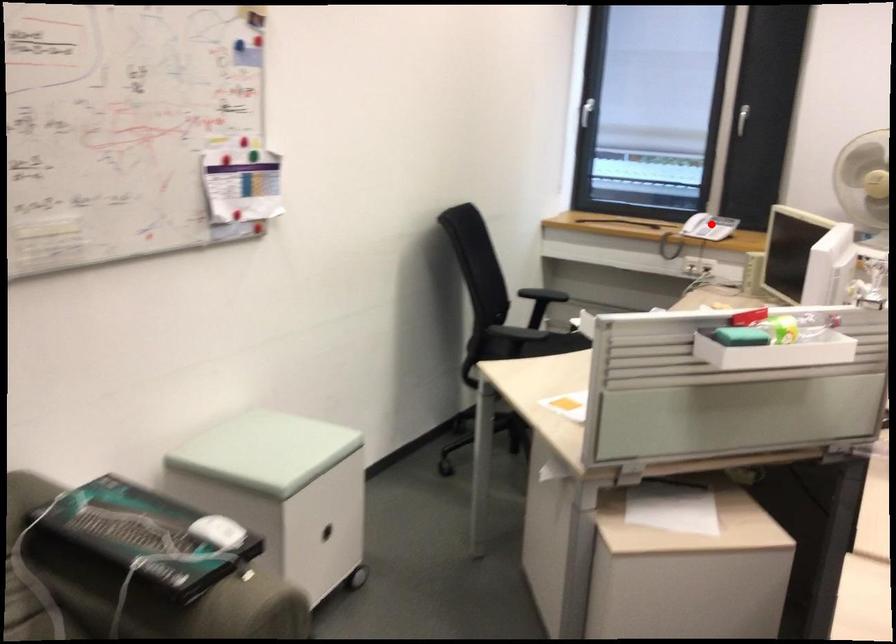
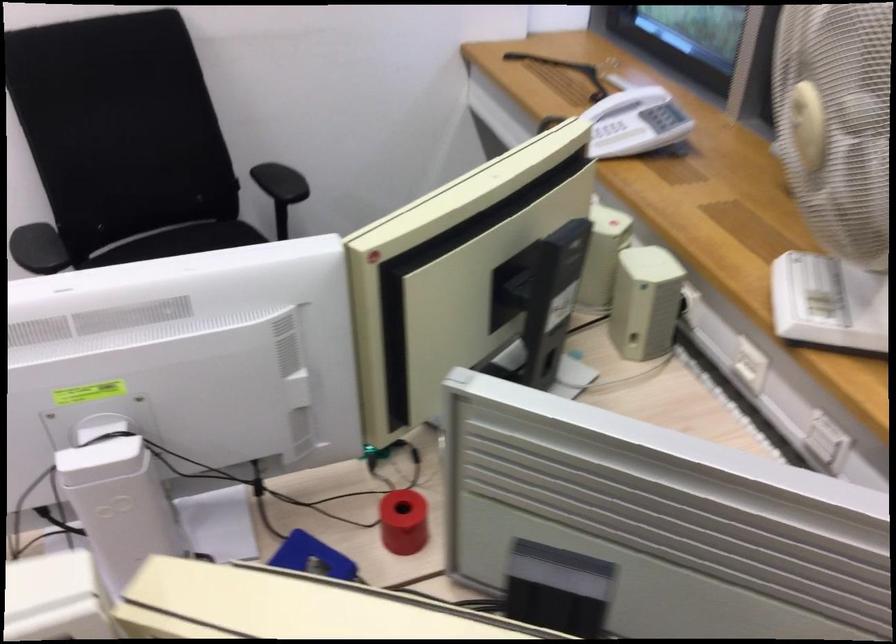
Locate, in the second image, the point that corresponds to the highlighted location in the first image.

(612, 131)